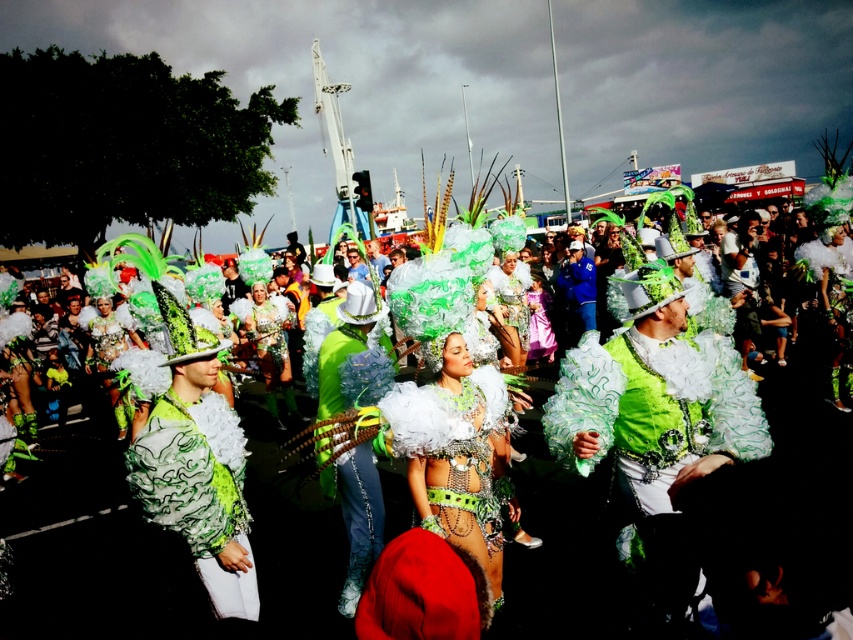
You are a photographer standing at the edge of the parade. You want to capture the green shiny feathers at center in your shot. Where should you aim your camera?

The green shiny feathers at center are located at coordinates point (158, 550), so aim your camera towards that point to capture them.

You are a photographer at the parade. You want to capture a photo that includes both the green shiny feathers at center and the green matte fabric costume at center. Which object should you focus on first to ensure both are in the frame?

The green shiny feathers at center are in front of the green matte fabric costume at center. Focus on the green shiny feathers at center first to ensure both are visible in the photo.

You are a photographer at the parade. You want to capture a closeup shot of the green shiny feathers at center and the green matte fabric costume at center. Which object should you zoom in on more to fit both in the frame?

Since the green shiny feathers at center is smaller than the green matte fabric costume at center, you should zoom in more on the green shiny feathers at center to ensure both fit in the frame.